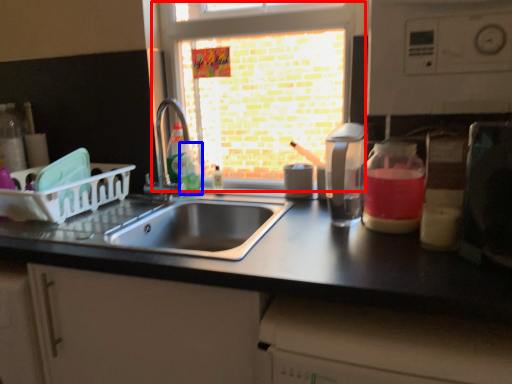
Question: Among these objects, which one is farthest to the camera, window (highlighted by a red box) or bottle (highlighted by a blue box)?

Choices:
 (A) window
 (B) bottle

Answer: (B)